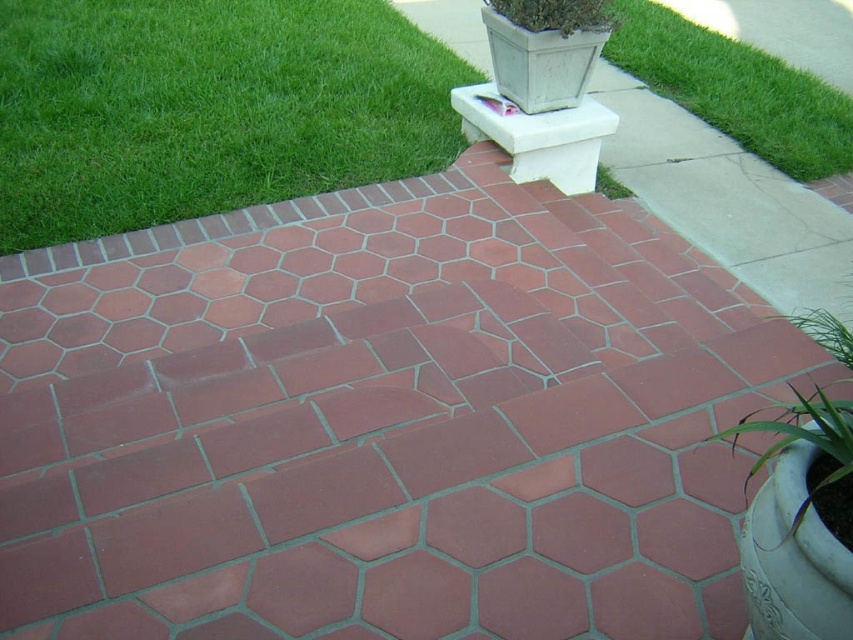
Question: Which point is closer to the camera taking this photo?

Choices:
 (A) (718, 436)
 (B) (277, 51)

Answer: (A)

Question: Which object is positioned closest to the green leafy plant at lower right?

Choices:
 (A) green grass at upper right
 (B) green grass at upper left

Answer: (A)

Question: Does green grass at upper right appear on the left side of green leafy plant at lower right?

Choices:
 (A) no
 (B) yes

Answer: (A)

Question: Is green grass at upper left positioned in front of green grass at upper right?

Choices:
 (A) yes
 (B) no

Answer: (A)

Question: Is green grass at upper right above green leafy plant at lower right?

Choices:
 (A) yes
 (B) no

Answer: (A)

Question: Which point is farther to the camera?

Choices:
 (A) green grass at upper left
 (B) green grass at upper right

Answer: (B)